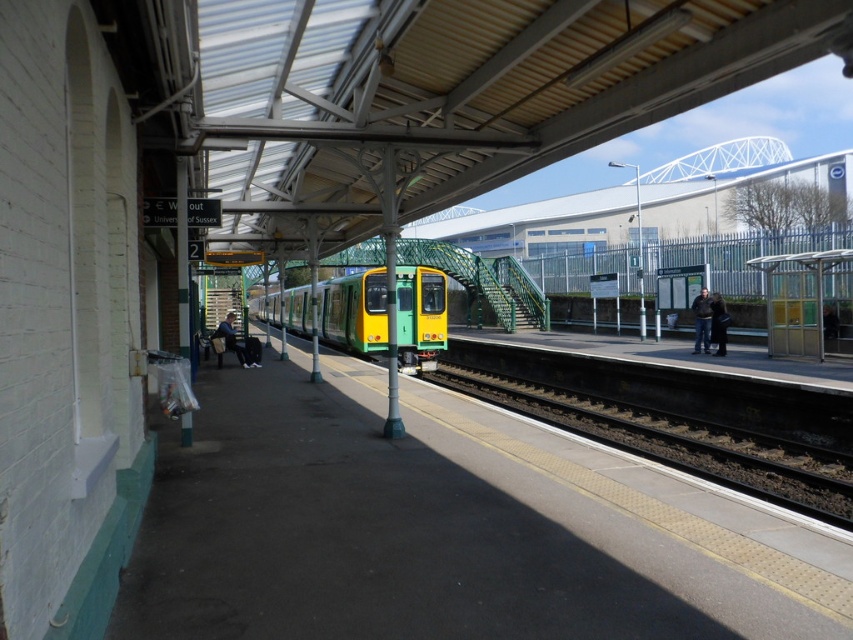
You are standing on the train station platform and want to take a photo of both point (225, 369) and point (370, 310) in the image. Which point should you focus on first to ensure both are in clear view?

You should focus on point (225, 369) first because it is closer to the camera than point (370, 310), ensuring both points are in focus.

You are standing on the platform and want to take a photo of both the signpost and the trash bin. The signpost is located at point (701, 572) and the trash bin is at point (248, 364). To ensure both are in the frame, which point should be closer to the camera when you take the picture?

Point (701, 572) is closer to the camera than point (248, 364), so when taking the photo, ensure the signpost at point (701, 572) is closer to the camera to include both in the frame.